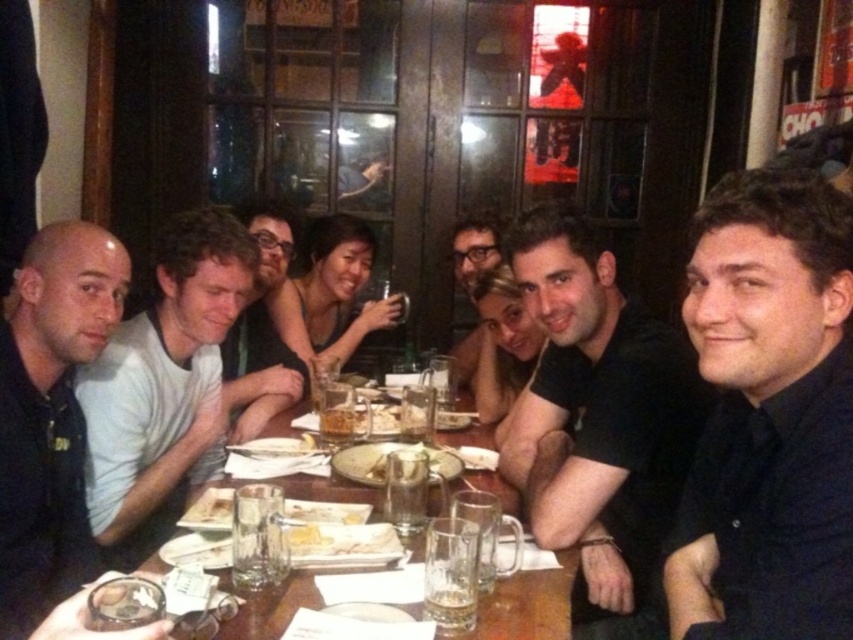
You are a waiter in a restaurant. You need to place a new drink order for the customer wearing the black matte shirt at center. Where should you place the drink relative to the translucent glass beer at center?

The black matte shirt at center is to the right of the translucent glass beer at center, so you should place the new drink to the left of the translucent glass beer at center to avoid blocking the customer.

You are a server in a restaurant and need to place a new drink order for the customers seated around the wooden table. The order includes a new mug and a beer. The existing items on the table include a translucent glass mug at center and a translucent glass beer at center. To avoid spilling, you must place the new drinks at least 30 inches apart. Can you safely place the new drinks on the table without violating this distance requirement?

The existing translucent glass mug at center and translucent glass beer at center are already 31.01 inches apart, so placing the new drinks in the same positions would satisfy the 30 inches distance requirement.